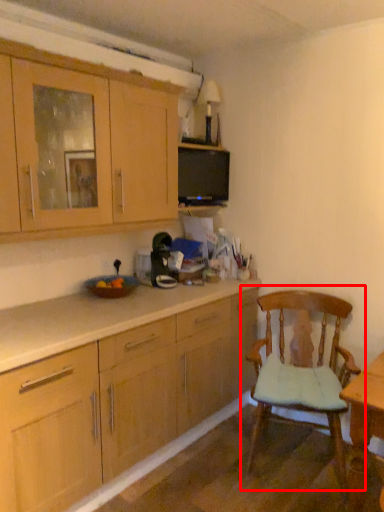
Question: From the image's perspective, considering the relative positions of chair (annotated by the red box) and cabinetry in the image provided, where is chair (annotated by the red box) located with respect to the staircase?

Choices:
 (A) below
 (B) above

Answer: (A)